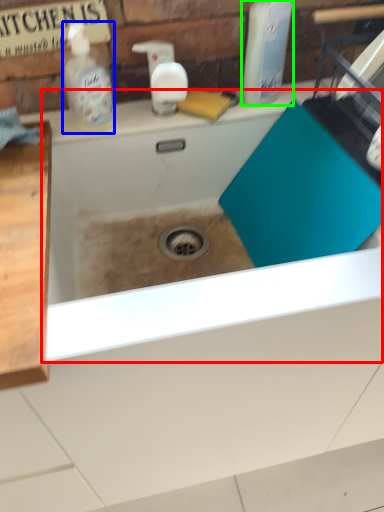
Question: Which is farther away from bath (highlighted by a red box)? cleaning product (highlighted by a blue box) or cleaning product (highlighted by a green box)?

Choices:
 (A) cleaning product
 (B) cleaning product

Answer: (B)